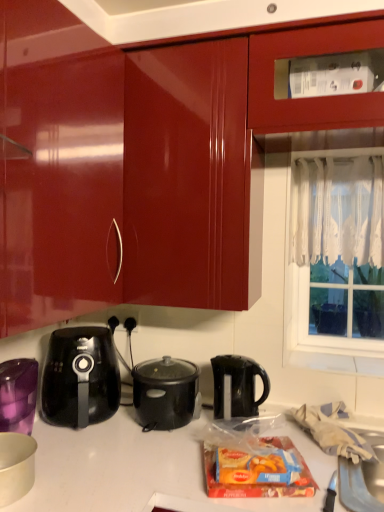
Question: Can you confirm if black plastic kettle at lower left, acting as the first kettle starting from the left, is positioned to the left of glossy wood cabinet at upper center?

Choices:
 (A) no
 (B) yes

Answer: (B)

Question: Is glossy wood cabinet at upper center located within black plastic kettle at lower left, the second kettle positioned from the right?

Choices:
 (A) no
 (B) yes

Answer: (A)

Question: Are black plastic kettle at lower left, the second kettle positioned from the right, and glossy wood cabinet at upper center far apart?

Choices:
 (A) yes
 (B) no

Answer: (B)

Question: Is black plastic kettle at lower left, the second kettle positioned from the right, taller than glossy wood cabinet at upper center?

Choices:
 (A) no
 (B) yes

Answer: (A)

Question: Is black plastic kettle at lower left, the second kettle positioned from the right, at the right side of glossy wood cabinet at upper center?

Choices:
 (A) yes
 (B) no

Answer: (B)

Question: Is black plastic kettle at lower left, acting as the first kettle starting from the left, shorter than glossy wood cabinet at upper center?

Choices:
 (A) no
 (B) yes

Answer: (B)

Question: Is glossy wood cabinet at upper center aimed at black plastic outlet at center?

Choices:
 (A) yes
 (B) no

Answer: (B)

Question: Considering the relative sizes of glossy wood cabinet at upper center and black plastic outlet at center in the image provided, is glossy wood cabinet at upper center shorter than black plastic outlet at center?

Choices:
 (A) yes
 (B) no

Answer: (B)

Question: Is glossy wood cabinet at upper center directly adjacent to black plastic outlet at center?

Choices:
 (A) no
 (B) yes

Answer: (A)

Question: Can you confirm if glossy wood cabinet at upper center is taller than black plastic outlet at center?

Choices:
 (A) yes
 (B) no

Answer: (A)

Question: Can you confirm if glossy wood cabinet at upper center is positioned to the right of black plastic outlet at center?

Choices:
 (A) no
 (B) yes

Answer: (B)

Question: Is the position of glossy wood cabinet at upper center less distant than that of black plastic outlet at center?

Choices:
 (A) yes
 (B) no

Answer: (A)

Question: Can you confirm if white matte bowl at lower left, the 1th kitchen appliance viewed from the left, is taller than black plastic slow cooker at center, which ranks as the 2th kitchen appliance in left-to-right order?

Choices:
 (A) no
 (B) yes

Answer: (A)